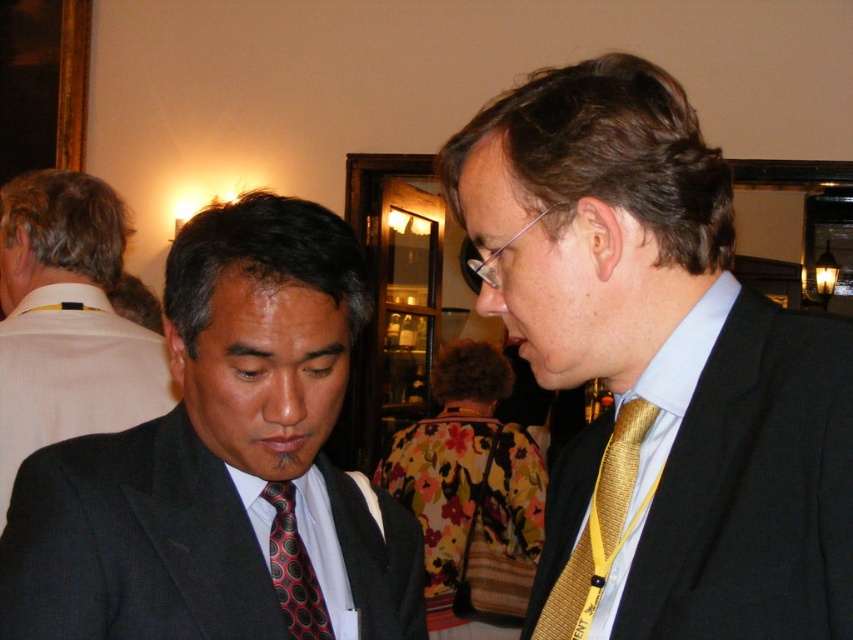
Question: Among these points, which one is farthest from the camera?

Choices:
 (A) pyautogui.click(x=91, y=259)
 (B) pyautogui.click(x=660, y=372)
 (C) pyautogui.click(x=636, y=436)

Answer: (A)

Question: Does gold textured tie at center have a greater width compared to gold silk tie at right?

Choices:
 (A) no
 (B) yes

Answer: (B)

Question: Is gold textured tie at center thinner than matte black suit at left?

Choices:
 (A) no
 (B) yes

Answer: (B)

Question: Does black suit at left appear under gold silk tie at right?

Choices:
 (A) yes
 (B) no

Answer: (B)

Question: Estimate the real-world distances between objects in this image. Which object is farther from the gold textured tie at center?

Choices:
 (A) black suit at left
 (B) gold silk tie at right
 (C) light blue satin dress shirt at right
 (D) matte black suit at left

Answer: (A)

Question: Estimate the real-world distances between objects in this image. Which object is farther from the red dotted tie at center?

Choices:
 (A) light blue satin dress shirt at right
 (B) gold silk tie at right
 (C) matte black suit at left
 (D) black suit at left

Answer: (D)